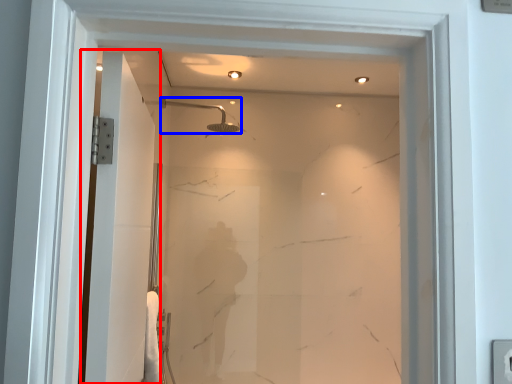
Question: Which of the following is the closest to the observer, screen door (highlighted by a red box) or shower (highlighted by a blue box)?

Choices:
 (A) screen door
 (B) shower

Answer: (A)